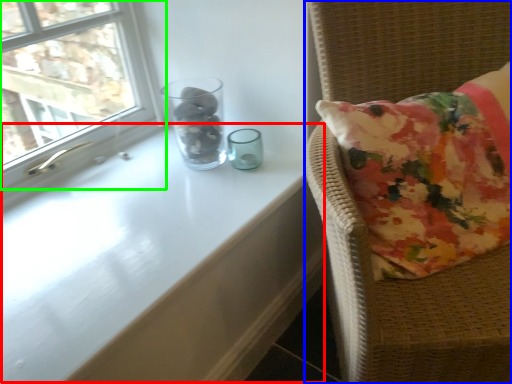
Question: Considering the real-world distances, which object is farthest from table (highlighted by a red box)? furniture (highlighted by a blue box) or window (highlighted by a green box)?

Choices:
 (A) furniture
 (B) window

Answer: (B)